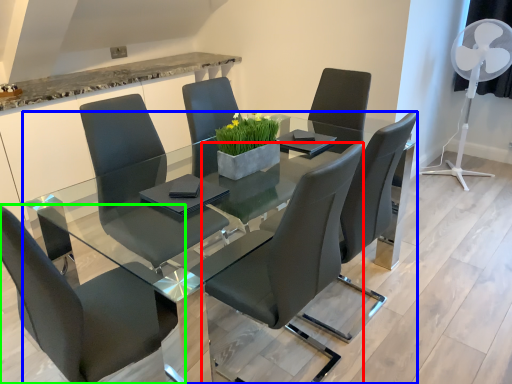
Question: Which object is positioned farthest from chair (highlighted by a red box)? Select from table (highlighted by a blue box) and chair (highlighted by a green box).

Choices:
 (A) table
 (B) chair

Answer: (B)